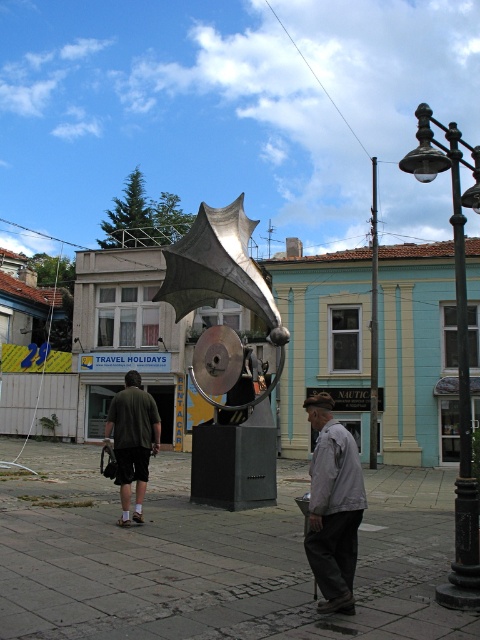
Does point (349, 584) lie in front of point (371, 344)?

Yes, it is.

Describe the element at coordinates (333, 506) in the screenshot. Image resolution: width=480 pixels, height=640 pixels. I see `light gray fabric jacket at center` at that location.

Locate an element on the screen. The image size is (480, 640). light gray fabric jacket at center is located at coordinates (333, 506).

Can you confirm if black metal streetlight at right is smaller than light gray fabric jacket at center?

No.

Who is shorter, black metal streetlight at right or light gray fabric jacket at center?

light gray fabric jacket at center is shorter.

Between point (465, 413) and point (312, 557), which one is positioned in front?

Point (312, 557)

Where is `black metal streetlight at right`? This screenshot has height=640, width=480. black metal streetlight at right is located at coordinates (457, 349).

Who is positioned more to the left, shiny metallic sculpture at center or dark green fabric pants at lower left?

dark green fabric pants at lower left is more to the left.

Is shiny metallic sculpture at center below dark green fabric pants at lower left?

Incorrect, shiny metallic sculpture at center is not positioned below dark green fabric pants at lower left.

Find the location of a particular element. shiny metallic sculpture at center is located at coordinates (225, 356).